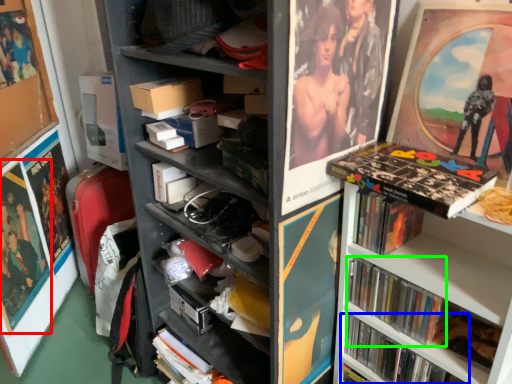
Question: Which object is positioned closest to poster page (highlighted by a red box)? Select from book (highlighted by a blue box) and book (highlighted by a green box).

Choices:
 (A) book
 (B) book

Answer: (A)